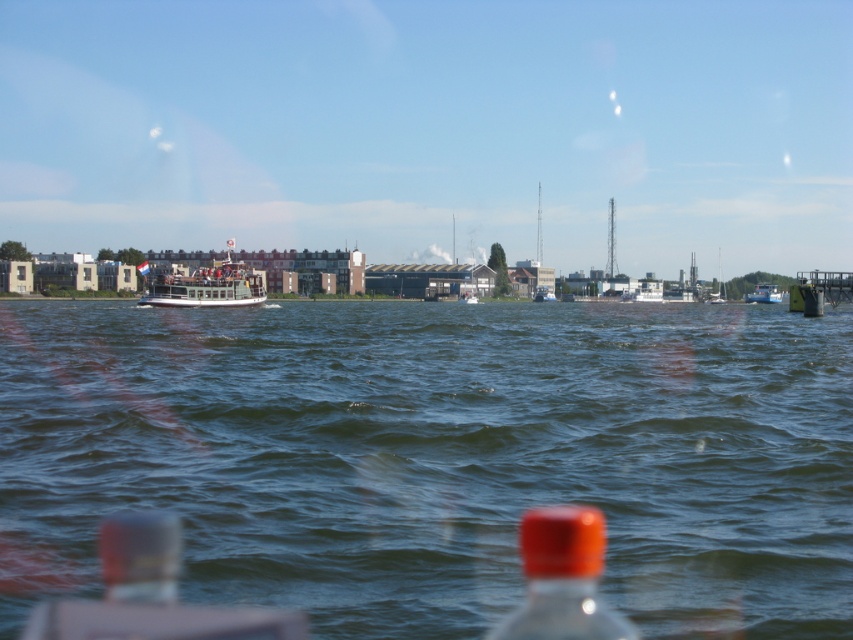
You are a photographer standing at the waterfront. You want to capture a photo of the blue matte boat at center without any obstructions. However, there is a translucent plastic bottle at lower center in the way. Based on their positions, can you adjust your camera angle to avoid the bottle?

The translucent plastic bottle at lower center is below the blue matte boat at center, so tilting the camera upwards or moving to a higher position would allow you to frame the blue matte boat at center without the bottle obstructing the view.

You are a photographer standing at the waterfront and want to capture a photo that includes both the translucent plastic bottle at lower center and the white wooden ferry at center. Based on their positions, which object should you adjust your camera angle to focus on first to ensure both are in the frame?

The translucent plastic bottle at lower center is located below the white wooden ferry at center, so you should first focus on the white wooden ferry at center to ensure the bottle below it is also captured in the frame.